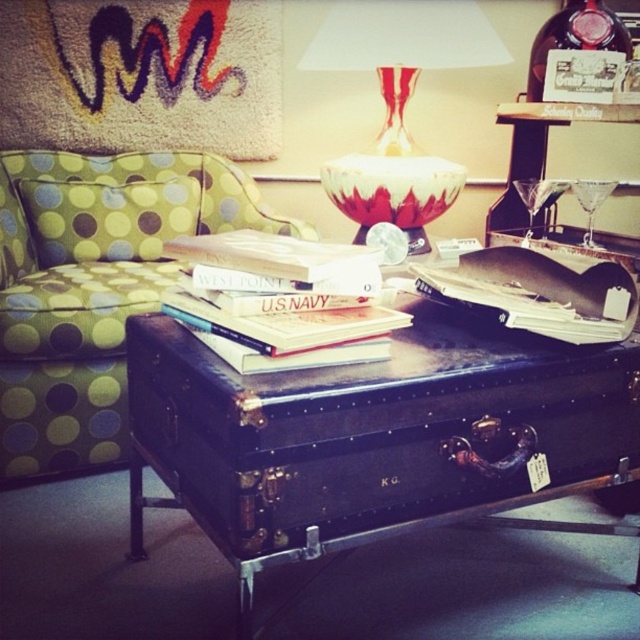
Can you confirm if green polka dot fabric couch at left is thinner than red and white glass vase at center?

In fact, green polka dot fabric couch at left might be wider than red and white glass vase at center.

Is the position of green polka dot fabric couch at left more distant than that of red and white glass vase at center?

No, it is in front of red and white glass vase at center.

Does point (4, 464) lie in front of point (424, 60)?

Yes, point (4, 464) is closer to viewer.

Image resolution: width=640 pixels, height=640 pixels. Identify the location of green polka dot fabric couch at left. (93, 288).

Is point (113, 442) closer to viewer compared to point (192, 253)?

No, (113, 442) is behind (192, 253).

Is green polka dot fabric couch at left behind hardcover books at center?

That is True.

Describe the element at coordinates (93, 288) in the screenshot. I see `green polka dot fabric couch at left` at that location.

Where is `green polka dot fabric couch at left`? green polka dot fabric couch at left is located at coordinates (93, 288).

Which is more to the left, black leather suitcase at center or hardcover books at center?

hardcover books at center is more to the left.

Is black leather suitcase at center taller than hardcover books at center?

Yes, black leather suitcase at center is taller than hardcover books at center.

Does point (308, 522) lie behind point (189, 316)?

No, it is in front of (189, 316).

You are a GUI agent. You are given a task and a screenshot of the screen. Output one action in this format:
    pyautogui.click(x=<x>, y=<y>)
    Task: Click on the black leather suitcase at center
    The image size is (640, 640).
    Given the screenshot: What is the action you would take?
    pyautogui.click(x=372, y=435)